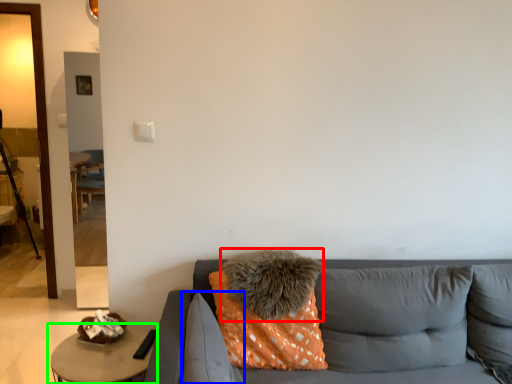
Question: Based on their relative distances, which object is farther from pillow (highlighted by a red box)? Choose from pillow (highlighted by a blue box) and table (highlighted by a green box).

Choices:
 (A) pillow
 (B) table

Answer: (B)